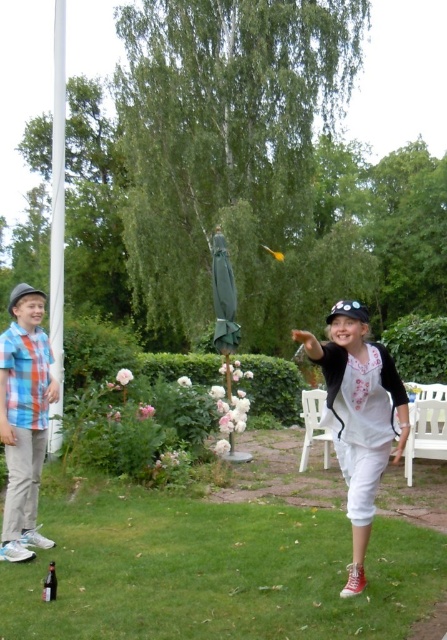
You are a photographer positioned at the center of the scene. You want to take a photo that includes both the blue plaid shirt at left and the white plastic chair at lower right. Given their distance apart, will you be able to capture both in a single frame without moving your position?

The blue plaid shirt at left is 3.97 meters away from the white plastic chair at lower right. Since the distance between them is 3.97 meters, it depends on the camera lens used. A standard lens might require adjusting the zoom, but with a wide enough angle, both could be captured in one frame without moving.

You are standing in the garden and want to sit on one of the white plastic chairs. Which chair, the white plastic chair at lower right or the white plastic chair at lower center, is closer to you?

The white plastic chair at lower right is closer to the viewer than the white plastic chair at lower center, so you should choose the white plastic chair at lower right.

You are a photographer trying to capture a group photo of the white cotton shirt at center and the blue plaid shirt at left. You need to ensure that both subjects are in focus. Given that your camera has a depth of field range of 8 feet, will you be able to get both shirts in focus without adjusting your camera settings?

The white cotton shirt at center and blue plaid shirt at left are 8.11 feet apart from each other. Since the distance between them exceeds the camera depth of field range of 8 feet, you will need to adjust your camera settings to ensure both are in focus.